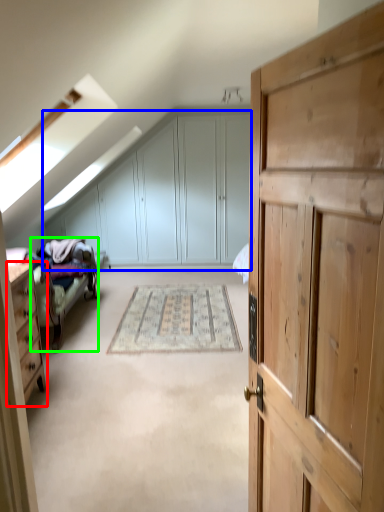
Question: Which is nearer to the chest of drawers (highlighted by a red box)? dresser (highlighted by a blue box) or bed frame (highlighted by a green box).

Choices:
 (A) dresser
 (B) bed frame

Answer: (B)